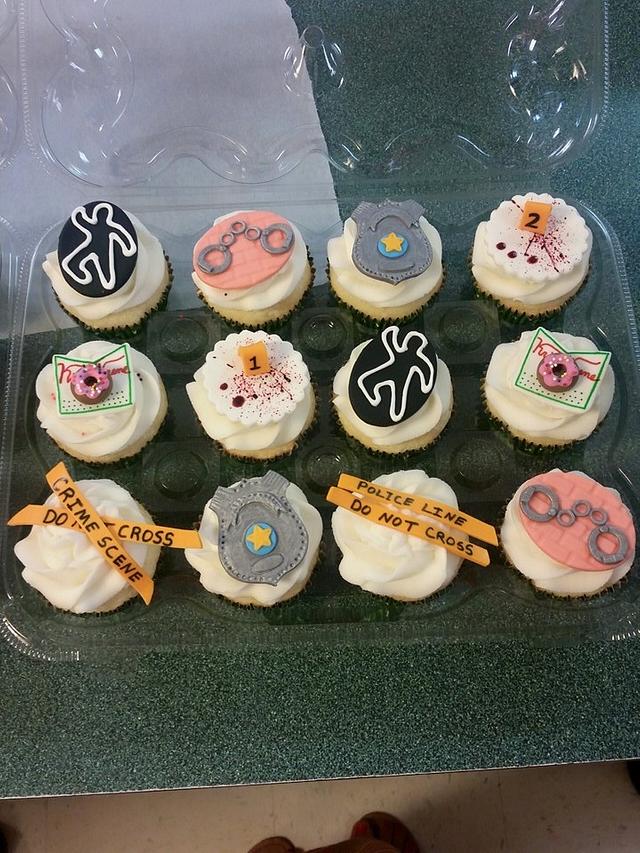
You are a GUI agent. You are given a task and a screenshot of the screen. Output one action in this format:
    pyautogui.click(x=<x>, y=<y>)
    Task: Click on the floor
    The image size is (640, 853).
    Given the screenshot: What is the action you would take?
    pyautogui.click(x=27, y=816), pyautogui.click(x=112, y=819), pyautogui.click(x=250, y=816), pyautogui.click(x=349, y=798), pyautogui.click(x=505, y=798), pyautogui.click(x=589, y=801), pyautogui.click(x=523, y=836)